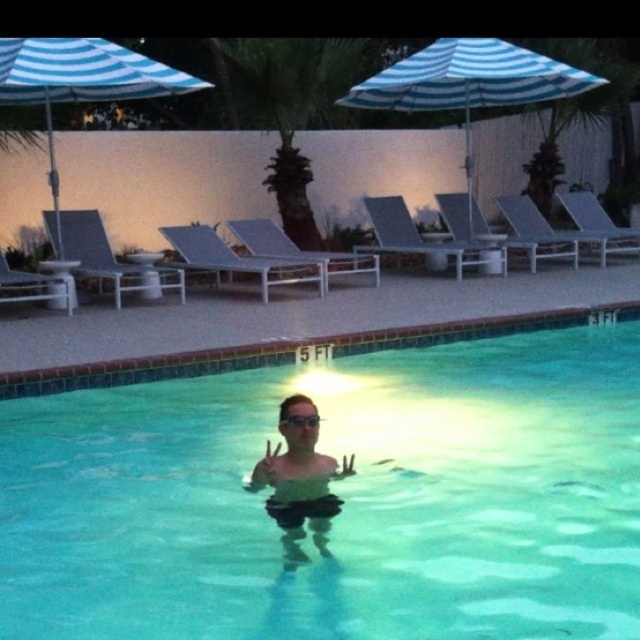
Does point (310, 380) come farther from viewer compared to point (154, 65)?

No, it is not.

Measure the distance from clear glass water at center to blue striped umbrella at upper left.

clear glass water at center is 13.76 feet away from blue striped umbrella at upper left.

You are a GUI agent. You are given a task and a screenshot of the screen. Output one action in this format:
    pyautogui.click(x=<x>, y=<y>)
    Task: Click on the clear glass water at center
    This screenshot has height=640, width=640.
    Given the screenshot: What is the action you would take?
    pyautogui.click(x=337, y=493)

Between clear skin at center and transparent plastic goggles at center, which one is positioned higher?

transparent plastic goggles at center is above.

Can you confirm if clear skin at center is positioned above transparent plastic goggles at center?

Actually, clear skin at center is below transparent plastic goggles at center.

Where is `clear skin at center`? clear skin at center is located at coordinates (300, 483).

Is point (486, 582) farther from viewer compared to point (292, 492)?

No, (486, 582) is in front of (292, 492).

From the picture: Who is taller, clear glass water at center or clear skin at center?

With more height is clear glass water at center.

Locate an element on the screen. The image size is (640, 640). clear glass water at center is located at coordinates (337, 493).